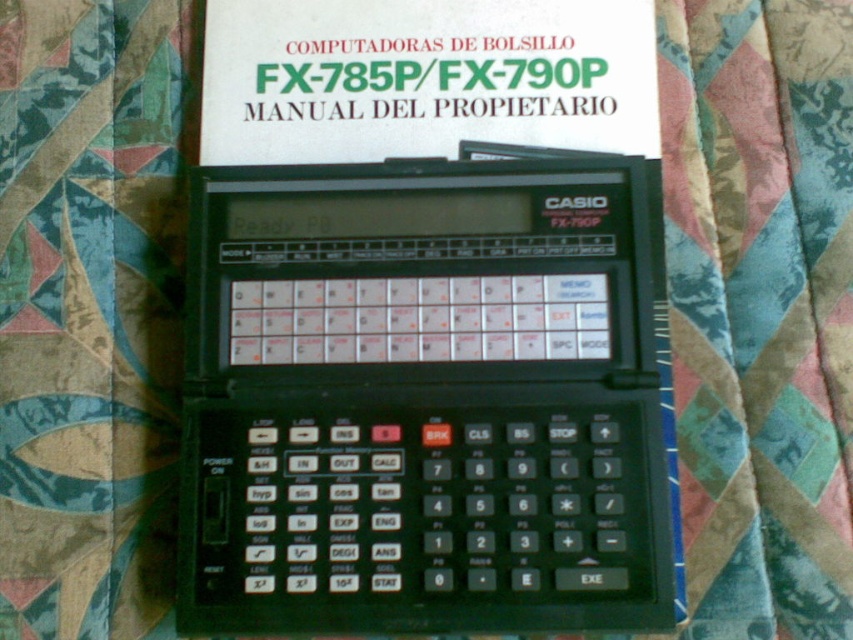
Question: Can you confirm if black plastic calculator at center is wider than white paper manual at upper center?

Choices:
 (A) no
 (B) yes

Answer: (A)

Question: Which of the following is the farthest from the observer?

Choices:
 (A) (712, 410)
 (B) (236, 145)

Answer: (B)

Question: Which of the following is the closest to the observer?

Choices:
 (A) (285, 433)
 (B) (438, 140)
 (C) (740, 449)

Answer: (A)

Question: Does textured fabric at center appear under white paper manual at upper center?

Choices:
 (A) yes
 (B) no

Answer: (A)

Question: Which of the following is the farthest from the observer?

Choices:
 (A) (762, 150)
 (B) (434, 70)

Answer: (B)

Question: Can you confirm if textured fabric at center is positioned to the left of white paper manual at upper center?

Choices:
 (A) yes
 (B) no

Answer: (B)